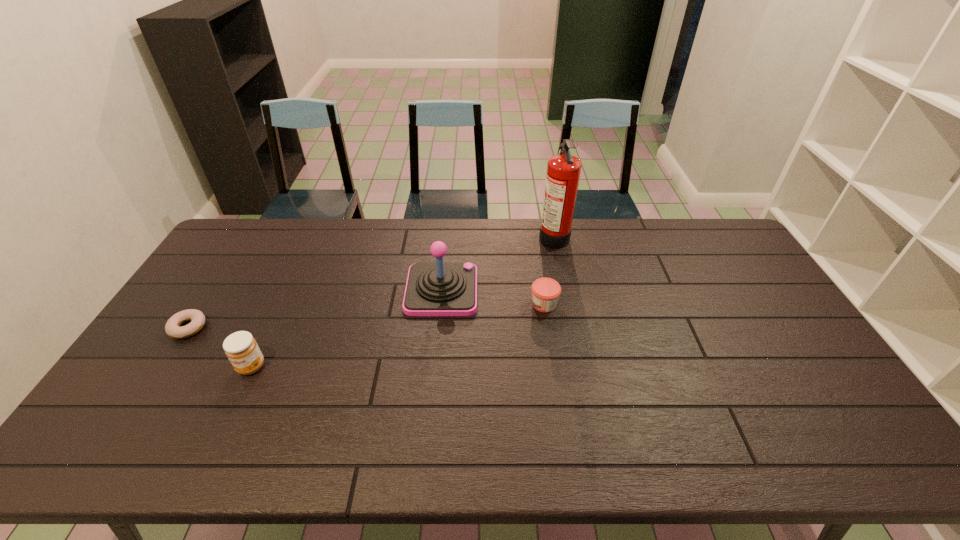
Image resolution: width=960 pixels, height=540 pixels. Find the location of `vacant space situated on the front-facing side of the tallest object`. vacant space situated on the front-facing side of the tallest object is located at coordinates (517, 235).

Locate an element on the screen. The height and width of the screenshot is (540, 960). blank area located 0.270m on the front-facing side of the tallest object is located at coordinates (467, 235).

At what (x,y) coordinates should I click in order to perform the action: click on vacant area located on the front-facing side of the tallest object. Please return your answer as a coordinate pair (x, y). Looking at the image, I should click on (498, 235).

Where is `free spot located forward from the base of the joystick`? Image resolution: width=960 pixels, height=540 pixels. free spot located forward from the base of the joystick is located at coordinates (523, 291).

Where is `vacant area situated 0.220m on the front label of the second object from left to right`? vacant area situated 0.220m on the front label of the second object from left to right is located at coordinates (208, 458).

Locate an element on the screen. Image resolution: width=960 pixels, height=540 pixels. vacant space located 0.310m on the front label of the fourth tallest object is located at coordinates (431, 304).

Where is `free space located 0.360m on the front label of the fourth tallest object`? free space located 0.360m on the front label of the fourth tallest object is located at coordinates (415, 304).

Locate an element on the screen. free space located on the front label of the fourth tallest object is located at coordinates [466, 304].

In order to click on blank area located on the front of the leftmost object in this screenshot , I will do `click(139, 402)`.

This screenshot has height=540, width=960. I want to click on object that is at the far edge, so click(563, 172).